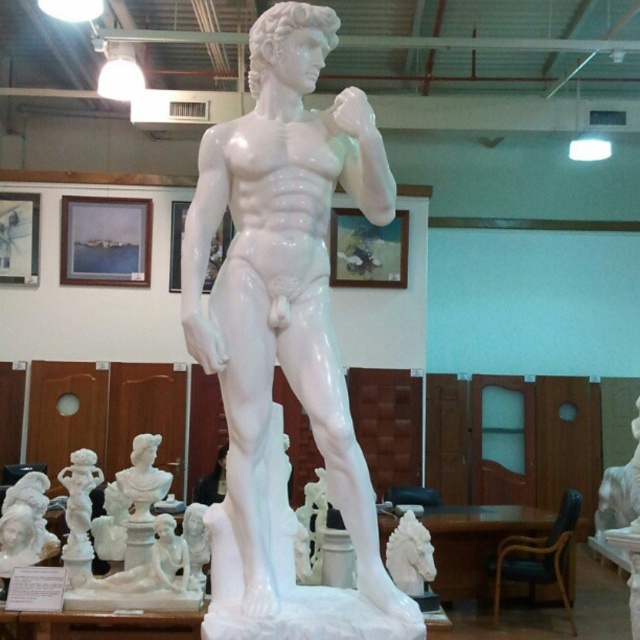
Question: Based on their relative distances, which object is nearer to the white glossy horse at lower center?

Choices:
 (A) white marble bust at lower left
 (B) white marble bust at right

Answer: (A)

Question: Is white glossy cherub at lower left below white marble bust at right?

Choices:
 (A) yes
 (B) no

Answer: (B)

Question: Is white glossy cherub at lower left above white marble bust at right?

Choices:
 (A) yes
 (B) no

Answer: (A)

Question: Which of these objects is positioned farthest from the white marble bust at lower left?

Choices:
 (A) white marble bust at right
 (B) white glossy horse at lower center
 (C) white glossy statue at center

Answer: (A)

Question: Is the position of white glossy horse at lower center less distant than that of white marble bust at right?

Choices:
 (A) yes
 (B) no

Answer: (A)

Question: Which point is farther to the camera?

Choices:
 (A) (614, 480)
 (B) (88, 460)
 (C) (412, 589)
 (D) (202, 170)

Answer: (A)